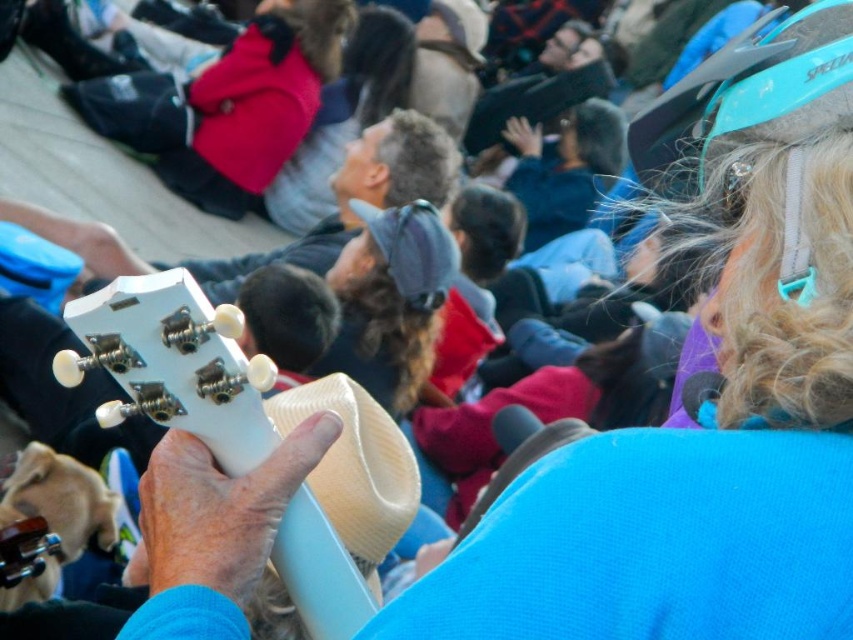
Question: Which object is closer to the camera taking this photo?

Choices:
 (A) blue fabric jacket at center
 (B) beige woven cowboy hat at center
 (C) matte white ukulele at center

Answer: (B)

Question: Can you confirm if white matte guitar at center is smaller than blue fabric jacket at center?

Choices:
 (A) no
 (B) yes

Answer: (B)

Question: In this image, where is white matte guitar at center located relative to blue fabric jacket at center?

Choices:
 (A) left
 (B) right

Answer: (A)

Question: Which point is farther to the camera?

Choices:
 (A) matte white ukulele at center
 (B) blue fabric jacket at center
 (C) beige woven cowboy hat at center

Answer: (B)

Question: Considering the relative positions of matte white ukulele at center and beige woven cowboy hat at center in the image provided, where is matte white ukulele at center located with respect to beige woven cowboy hat at center?

Choices:
 (A) below
 (B) above

Answer: (B)

Question: Which object is positioned closest to the white matte guitar at center?

Choices:
 (A) matte white ukulele at center
 (B) blue fabric jacket at center

Answer: (A)